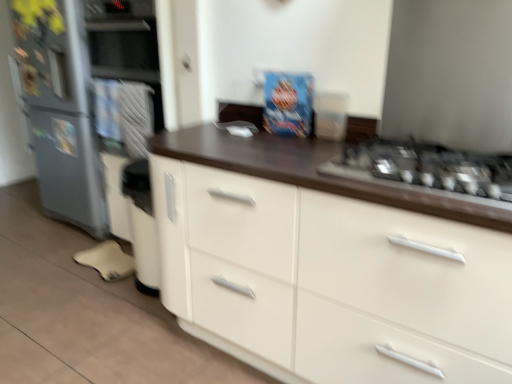
Locate an element on the screen. white glossy cabinet at center is located at coordinates (330, 281).

Find the location of `metallic gray refrigerator at left`. metallic gray refrigerator at left is located at coordinates (60, 110).

This screenshot has height=384, width=512. I want to click on refrigerator on the left of metallic silver gas stove at right, so click(60, 110).

Considering the sizes of objects metallic gray refrigerator at left and metallic silver gas stove at right in the image provided, who is thinner, metallic gray refrigerator at left or metallic silver gas stove at right?

metallic gray refrigerator at left is thinner.

Is point (61, 158) positioned behind point (396, 171)?

That is True.

From the image's perspective, between metallic gray refrigerator at left and metallic silver gas stove at right, who is located below?

metallic silver gas stove at right, from the image's perspective.

Between metallic silver gas stove at right and metallic gray refrigerator at left, which one appears on the right side from the viewer's perspective?

metallic silver gas stove at right is more to the right.

Is metallic silver gas stove at right next to metallic gray refrigerator at left?

No, metallic silver gas stove at right is not making contact with metallic gray refrigerator at left.

What's the angular difference between metallic silver gas stove at right and metallic gray refrigerator at left's facing directions?

The angle between the facing direction of metallic silver gas stove at right and the facing direction of metallic gray refrigerator at left is 1.87 degrees.

Can metallic gray refrigerator at left be found inside metallic silver gas stove at right?

No, metallic gray refrigerator at left is located outside of metallic silver gas stove at right.

Can you tell me how much metallic gray refrigerator at left and white glossy cabinet at center differ in facing direction?

They differ by 1.36 degrees in their facing directions.

Which of these two, metallic gray refrigerator at left or white glossy cabinet at center, stands taller?

Standing taller between the two is metallic gray refrigerator at left.

Considering the sizes of objects metallic gray refrigerator at left and white glossy cabinet at center in the image provided, who is thinner, metallic gray refrigerator at left or white glossy cabinet at center?

Thinner between the two is metallic gray refrigerator at left.

Would you say metallic gray refrigerator at left is a long distance from white glossy cabinet at center?

Yes, metallic gray refrigerator at left and white glossy cabinet at center are quite far apart.

Does metallic silver gas stove at right lie behind white glossy cabinet at center?

Yes, the depth of metallic silver gas stove at right is greater than that of white glossy cabinet at center.

Is metallic silver gas stove at right located outside white glossy cabinet at center?

Actually, metallic silver gas stove at right is within white glossy cabinet at center.

Which is more to the right, metallic silver gas stove at right or white glossy cabinet at center?

metallic silver gas stove at right.

Is metallic silver gas stove at right turned away from white glossy cabinet at center?

Absolutely, metallic silver gas stove at right is directed away from white glossy cabinet at center.

Considering the sizes of objects white glossy cabinet at center and metallic gray refrigerator at left in the image provided, who is bigger, white glossy cabinet at center or metallic gray refrigerator at left?

With larger size is white glossy cabinet at center.

Is white glossy cabinet at center facing away from metallic gray refrigerator at left?

No.

Can you see white glossy cabinet at center touching metallic gray refrigerator at left?

There is a gap between white glossy cabinet at center and metallic gray refrigerator at left.

Would you say white glossy cabinet at center is inside or outside metallic gray refrigerator at left?

white glossy cabinet at center lies outside metallic gray refrigerator at left.

Is white glossy cabinet at center facing away from metallic silver gas stove at right?

No.

Considering the relative positions of white glossy cabinet at center and metallic silver gas stove at right in the image provided, is white glossy cabinet at center to the left of metallic silver gas stove at right from the viewer's perspective?

Yes.

Considering the relative positions of white glossy cabinet at center and metallic silver gas stove at right in the image provided, is white glossy cabinet at center in front of metallic silver gas stove at right?

Yes, the depth of white glossy cabinet at center is less than that of metallic silver gas stove at right.

From the image's perspective, between white glossy cabinet at center and metallic silver gas stove at right, who is located below?

From the image's view, white glossy cabinet at center is below.

In the image, there is a metallic silver gas stove at right. Identify the location of refrigerator above it (from the image's perspective). (60, 110).

The height and width of the screenshot is (384, 512). What are the coordinates of `refrigerator beneath the metallic silver gas stove at right (from a real-world perspective)` in the screenshot? It's located at (60, 110).

When comparing their distances from metallic gray refrigerator at left, does metallic silver gas stove at right or white glossy cabinet at center seem further?

metallic silver gas stove at right.

When comparing their distances from metallic gray refrigerator at left, does white glossy cabinet at center or metallic silver gas stove at right seem closer?

white glossy cabinet at center is closer to metallic gray refrigerator at left.

Estimate the real-world distances between objects in this image. Which object is closer to white glossy cabinet at center, metallic silver gas stove at right or metallic gray refrigerator at left?

metallic silver gas stove at right lies closer to white glossy cabinet at center than the other object.

From the image, which object appears to be farther from white glossy cabinet at center, metallic gray refrigerator at left or metallic silver gas stove at right?

metallic gray refrigerator at left is positioned further to the anchor white glossy cabinet at center.

Estimate the real-world distances between objects in this image. Which object is further from metallic silver gas stove at right, metallic gray refrigerator at left or white glossy cabinet at center?

Based on the image, metallic gray refrigerator at left appears to be further to metallic silver gas stove at right.

Considering their positions, is white glossy cabinet at center positioned closer to metallic silver gas stove at right than metallic gray refrigerator at left?

white glossy cabinet at center is closer to metallic silver gas stove at right.

This screenshot has width=512, height=384. Identify the location of cabinetry between metallic gray refrigerator at left and metallic silver gas stove at right. (330, 281).